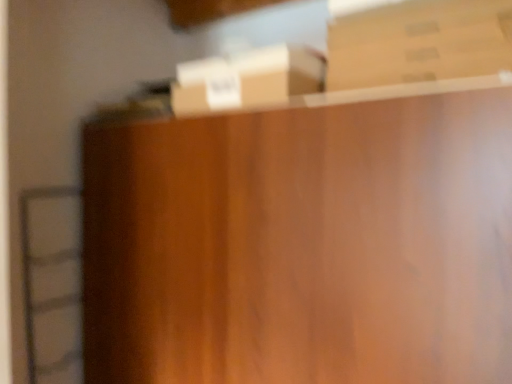
What do you see at coordinates (419, 42) in the screenshot? The height and width of the screenshot is (384, 512). I see `brown cardboard box at upper right, positioned as the 1th box in top-to-bottom order` at bounding box center [419, 42].

Measure the distance between brown cardboard box at upper right, positioned as the 1th box in top-to-bottom order, and camera.

33.69 inches.

Identify the location of brown cardboard box at upper right, which is the first box from right to left. (419, 42).

At what (x,y) coordinates should I click in order to perform the action: click on brown cardboard box at upper center, which is the 2th box from right to left. Please return your answer as a coordinate pair (x, y). Image resolution: width=512 pixels, height=384 pixels. Looking at the image, I should click on (247, 79).

What do you see at coordinates (247, 79) in the screenshot? This screenshot has width=512, height=384. I see `brown cardboard box at upper center, which is the 2th box from right to left` at bounding box center [247, 79].

Where is `brown cardboard box at upper right, which is the first box from right to left`? The height and width of the screenshot is (384, 512). brown cardboard box at upper right, which is the first box from right to left is located at coordinates (419, 42).

Is brown cardboard box at upper center, which is the 2th box from right to left, at the right side of brown cardboard box at upper right, acting as the second box starting from the left?

No, brown cardboard box at upper center, which is the 2th box from right to left, is not to the right of brown cardboard box at upper right, acting as the second box starting from the left.

Does brown cardboard box at upper center, which is the 2th box from right to left, come in front of brown cardboard box at upper right, the second box from the bottom?

No, brown cardboard box at upper center, which is the 2th box from right to left, is further to the viewer.

Does point (210, 77) come behind point (432, 21)?

Yes, point (210, 77) is farther from viewer.

From the image's perspective, which object appears higher, brown cardboard box at upper center, the first box positioned from the left, or brown cardboard box at upper right, positioned as the 1th box in top-to-bottom order?

From the image's view, brown cardboard box at upper right, positioned as the 1th box in top-to-bottom order, is above.

From a real-world perspective, is brown cardboard box at upper center, which is the 2th box from right to left, positioned over brown cardboard box at upper right, the second box from the bottom, based on gravity?

No, from a real-world perspective, brown cardboard box at upper center, which is the 2th box from right to left, is not above brown cardboard box at upper right, the second box from the bottom.

Considering the relative sizes of brown cardboard box at upper center, the second box viewed from the top, and brown cardboard box at upper right, the second box from the bottom, in the image provided, is brown cardboard box at upper center, the second box viewed from the top, thinner than brown cardboard box at upper right, the second box from the bottom,?

Yes, brown cardboard box at upper center, the second box viewed from the top, is thinner than brown cardboard box at upper right, the second box from the bottom.

Considering the relative sizes of brown cardboard box at upper center, the first box positioned from the left, and brown cardboard box at upper right, acting as the second box starting from the left, in the image provided, is brown cardboard box at upper center, the first box positioned from the left, taller than brown cardboard box at upper right, acting as the second box starting from the left,?

Yes, brown cardboard box at upper center, the first box positioned from the left, is taller than brown cardboard box at upper right, acting as the second box starting from the left.

Considering the sizes of objects brown cardboard box at upper center, the second box viewed from the top, and brown cardboard box at upper right, positioned as the 1th box in top-to-bottom order, in the image provided, who is bigger, brown cardboard box at upper center, the second box viewed from the top, or brown cardboard box at upper right, positioned as the 1th box in top-to-bottom order,?

With larger size is brown cardboard box at upper right, positioned as the 1th box in top-to-bottom order.

Could brown cardboard box at upper right, positioned as the 1th box in top-to-bottom order, be considered to be inside brown cardboard box at upper center, which is the 2th box from right to left?

That's incorrect, brown cardboard box at upper right, positioned as the 1th box in top-to-bottom order, is not inside brown cardboard box at upper center, which is the 2th box from right to left.

Is brown cardboard box at upper center, which is the 2th box from right to left, beside brown cardboard box at upper right, the second box from the bottom?

No, brown cardboard box at upper center, which is the 2th box from right to left, is not with brown cardboard box at upper right, the second box from the bottom.

Could you tell me if brown cardboard box at upper center, the first box positioned from the left, is facing brown cardboard box at upper right, positioned as the 1th box in top-to-bottom order?

No, brown cardboard box at upper center, the first box positioned from the left, is not oriented towards brown cardboard box at upper right, positioned as the 1th box in top-to-bottom order.

Locate an element on the screen. box located in front of the brown cardboard box at upper center, the first box positioned from the left is located at coordinates [x=419, y=42].

Is brown cardboard box at upper right, the second box from the bottom, to the right of brown cardboard box at upper center, the second box viewed from the top, from the viewer's perspective?

Yes.

Who is more distant, brown cardboard box at upper right, the second box from the bottom, or brown cardboard box at upper center, the first box positioned from the left?

Answer: brown cardboard box at upper center, the first box positioned from the left.

Is point (358, 41) in front of point (234, 76)?

Yes, it is in front of point (234, 76).

From the image's perspective, is brown cardboard box at upper right, acting as the second box starting from the left, over brown cardboard box at upper center, which is the 2th box from right to left?

Yes, from the image's perspective, brown cardboard box at upper right, acting as the second box starting from the left, is over brown cardboard box at upper center, which is the 2th box from right to left.

From a real-world perspective, which is physically above, brown cardboard box at upper right, the second box from the bottom, or brown cardboard box at upper center, which is the 2th box from right to left?

brown cardboard box at upper right, the second box from the bottom, is physically above.

Considering the relative sizes of brown cardboard box at upper right, which is the first box from right to left, and brown cardboard box at upper center, the first box positioned from the left, in the image provided, is brown cardboard box at upper right, which is the first box from right to left, thinner than brown cardboard box at upper center, the first box positioned from the left,?

In fact, brown cardboard box at upper right, which is the first box from right to left, might be wider than brown cardboard box at upper center, the first box positioned from the left.

Looking at this image, is brown cardboard box at upper right, acting as the second box starting from the left, taller than brown cardboard box at upper center, the first box positioned from the left?

No, brown cardboard box at upper right, acting as the second box starting from the left, is not taller than brown cardboard box at upper center, the first box positioned from the left.

Does brown cardboard box at upper right, the second box from the bottom, have a larger size compared to brown cardboard box at upper center, the second box viewed from the top?

Yes.

Can brown cardboard box at upper center, the first box positioned from the left, be found inside brown cardboard box at upper right, the second box from the bottom?

No, brown cardboard box at upper right, the second box from the bottom, does not contain brown cardboard box at upper center, the first box positioned from the left.

Is brown cardboard box at upper right, acting as the second box starting from the left, not close to brown cardboard box at upper center, the first box positioned from the left?

They are positioned close to each other.

Is brown cardboard box at upper right, acting as the second box starting from the left, looking in the opposite direction of brown cardboard box at upper center, the second box viewed from the top?

No, brown cardboard box at upper center, the second box viewed from the top, is not at the back of brown cardboard box at upper right, acting as the second box starting from the left.

How different are the orientations of brown cardboard box at upper right, the second box from the bottom, and brown cardboard box at upper center, the 1th box positioned from the bottom, in degrees?

There is a 2.67e-05-degree angle between the facing directions of brown cardboard box at upper right, the second box from the bottom, and brown cardboard box at upper center, the 1th box positioned from the bottom.

How much distance is there between brown cardboard box at upper right, acting as the second box starting from the left, and brown cardboard box at upper center, the second box viewed from the top?

A distance of 9.10 inches exists between brown cardboard box at upper right, acting as the second box starting from the left, and brown cardboard box at upper center, the second box viewed from the top.

In the image, there is a brown cardboard box at upper right, positioned as the 1th box in top-to-bottom order. Identify the location of box below it (from the image's perspective). 247,79.

You are a GUI agent. You are given a task and a screenshot of the screen. Output one action in this format:
    pyautogui.click(x=<x>, y=<y>)
    Task: Click on the box that appears on the right of brown cardboard box at upper center, the second box viewed from the top
    The image size is (512, 384).
    Given the screenshot: What is the action you would take?
    pyautogui.click(x=419, y=42)

Locate an element on the screen. This screenshot has width=512, height=384. box in front of the brown cardboard box at upper center, which is the 2th box from right to left is located at coordinates (419, 42).